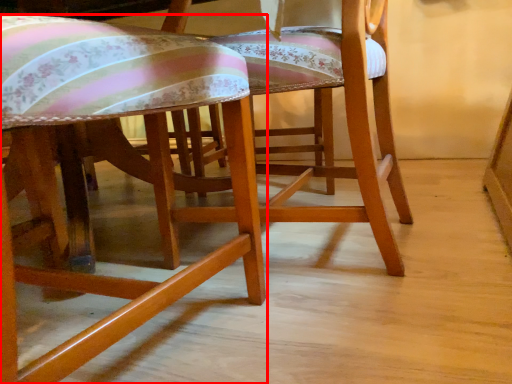
Question: From the image, what is the correct spatial relationship of chair (annotated by the red box) in relation to chair?

Choices:
 (A) right
 (B) left

Answer: (B)